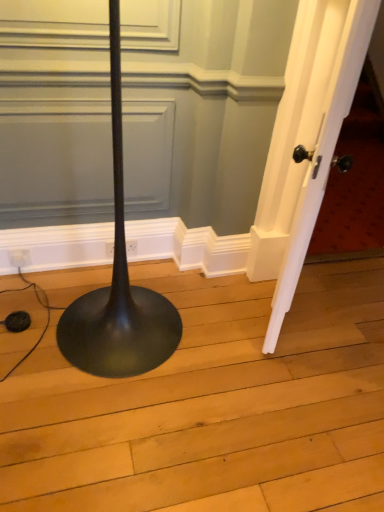
What do you see at coordinates (322, 156) in the screenshot? I see `white wooden door at right` at bounding box center [322, 156].

I want to click on white wooden door at right, so click(322, 156).

Find the location of `white wooden door at right`. white wooden door at right is located at coordinates (322, 156).